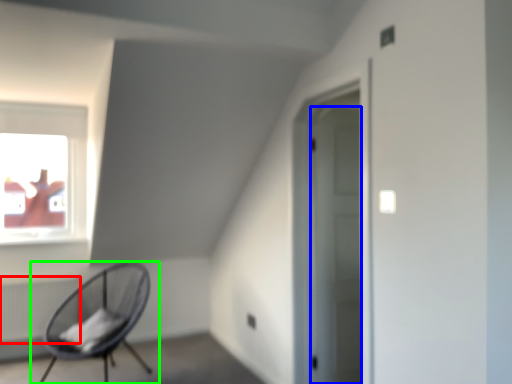
Question: Which is farther away from radiator (highlighted by a red box)? door (highlighted by a blue box) or chair (highlighted by a green box)?

Choices:
 (A) door
 (B) chair

Answer: (A)